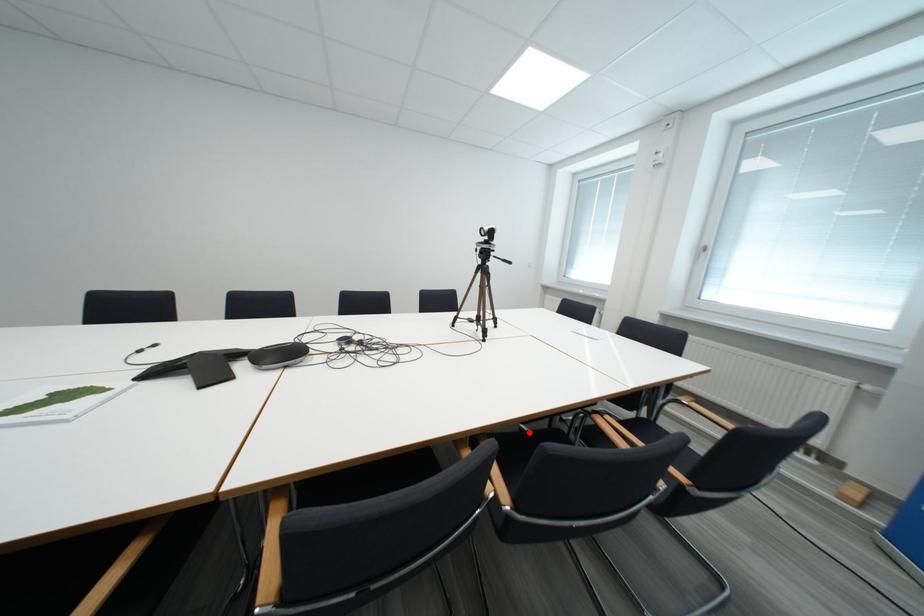
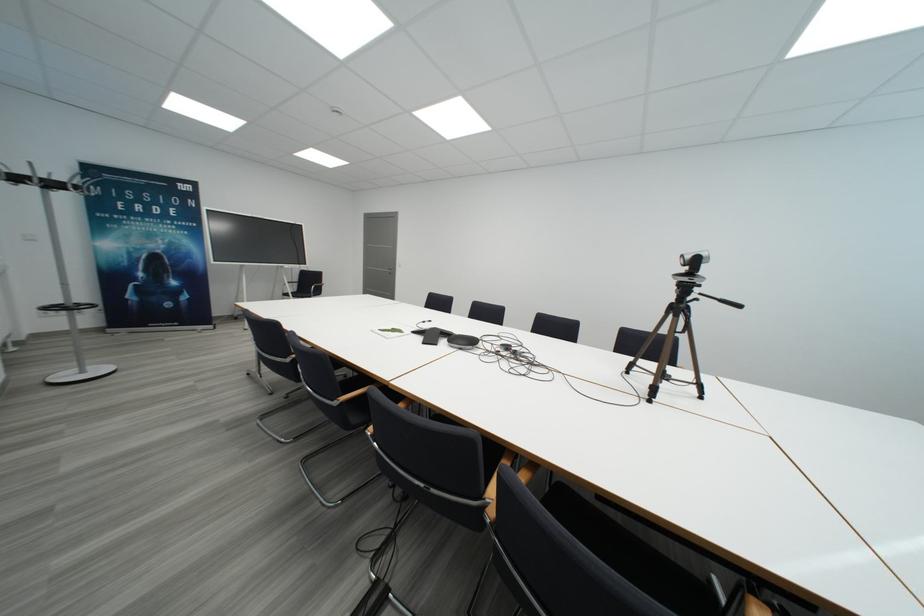
Question: I am providing you with two images of the same scene from different viewpoints. A red point is shown in image1. For the corresponding object point in image2, is it positioned nearer or farther from the camera?

Choices:
 (A) Nearer
 (B) Farther

Answer: (B)